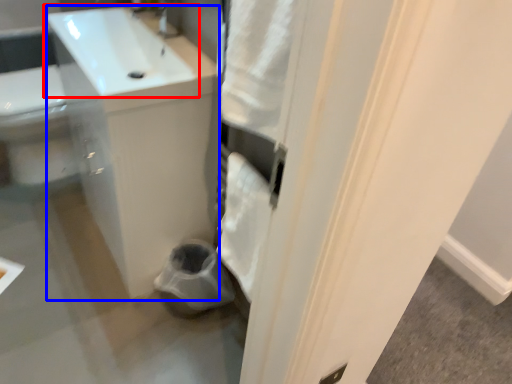
Question: Which object appears closest to the camera in this image, sink (highlighted by a red box) or counter top (highlighted by a blue box)?

Choices:
 (A) sink
 (B) counter top

Answer: (A)